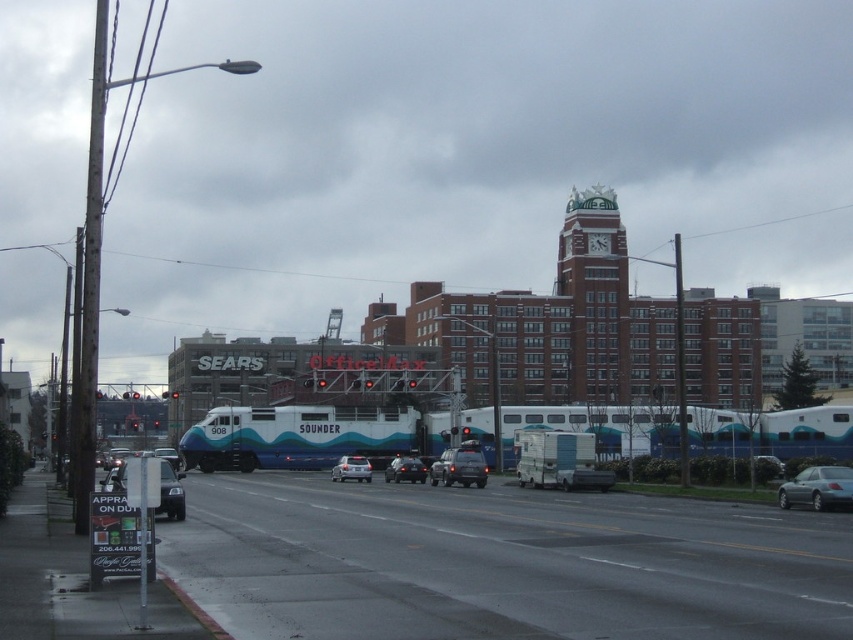
You are standing at the point marked as point (844, 500) in the image. You want to walk to the signboard on the left side. Is the signboard closer to you than 35 meters?

The distance of point (844, 500) from camera is 32.29 meters. Since the signboard is on the left side of the image, it is likely closer than 35 meters. However, the exact distance isn not provided in the objects description. Therefore, we cannot confirm if the signboard is within 35 meters based on the given information.

You are standing at the intersection where the road and the train tracks cross. There is a point marked at coordinates (817, 488). What object is located at this point?

The point at coordinates (817, 488) corresponds to a silver metallic sedan at lower right.